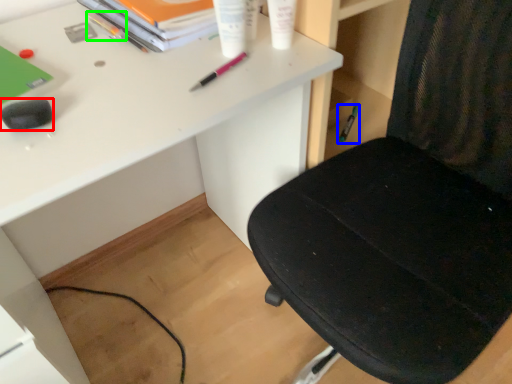
Question: Which object is positioned farthest from stationery (highlighted by a red box)? Select from stationery (highlighted by a blue box) and stationery (highlighted by a green box).

Choices:
 (A) stationery
 (B) stationery

Answer: (A)